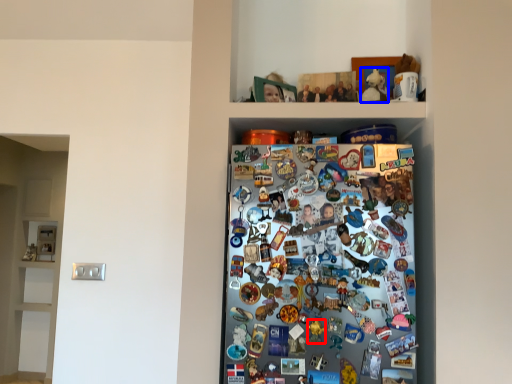
Question: Which of the following is the farthest to the observer, toy (highlighted by a red box) or toy (highlighted by a blue box)?

Choices:
 (A) toy
 (B) toy

Answer: (B)